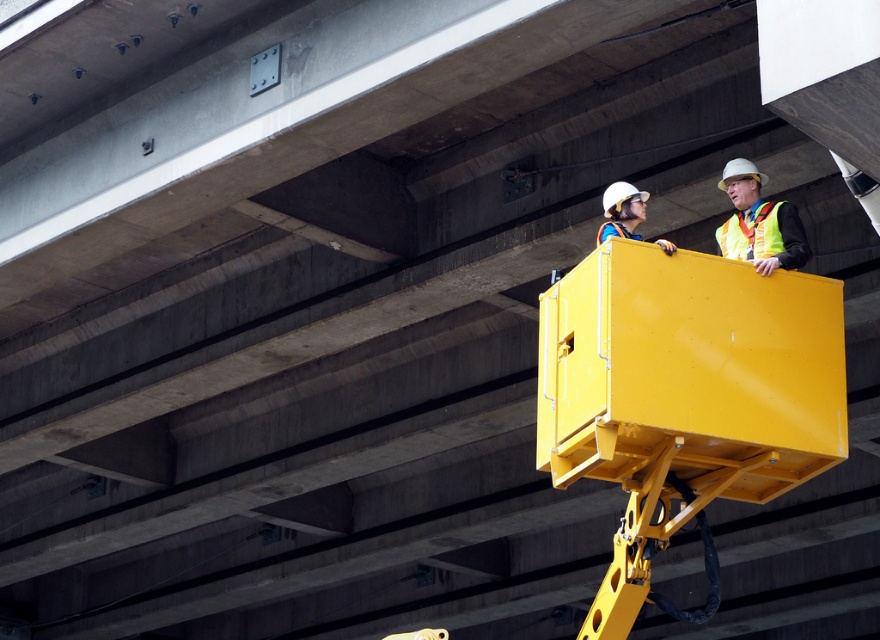
You are a safety inspector reviewing a construction site photo. You notice two items in the image labeled as the yellow reflective vest at upper right and the white hard hat at upper center. According to safety protocols, hard hats must be worn on the head, and reflective vests should be visible from all angles. Does the positioning of these items suggest that both workers are complying with safety standards?

The yellow reflective vest at upper right is positioned on the right side of white hard hat at upper center. This suggests that both items are worn correctly as the vest is visible from the side and the hard hat is properly placed on the head, complying with safety standards.